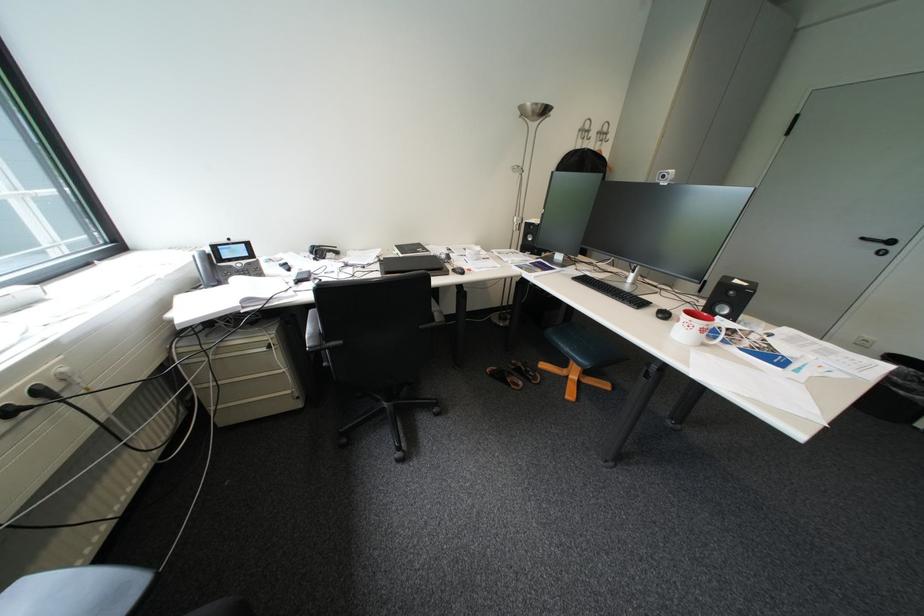
Image resolution: width=924 pixels, height=616 pixels. What are the coordinates of `blue stool sitting surface` in the screenshot? It's located at (584, 345).